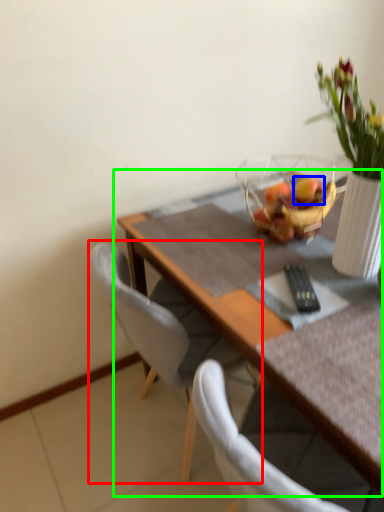
Question: Which object is the closest to the chair (highlighted by a red box)? Choose among these: flower (highlighted by a blue box) or table (highlighted by a green box).

Choices:
 (A) flower
 (B) table

Answer: (B)